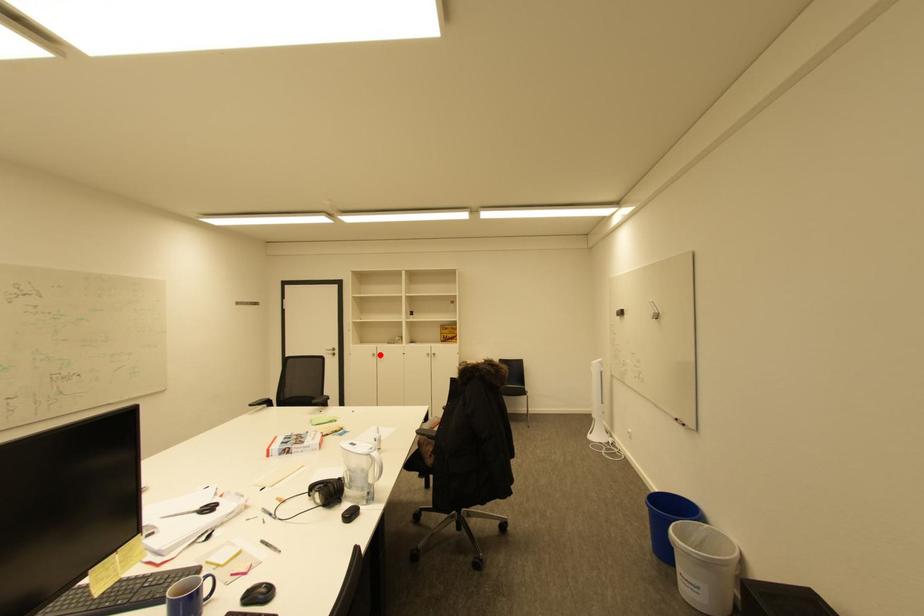
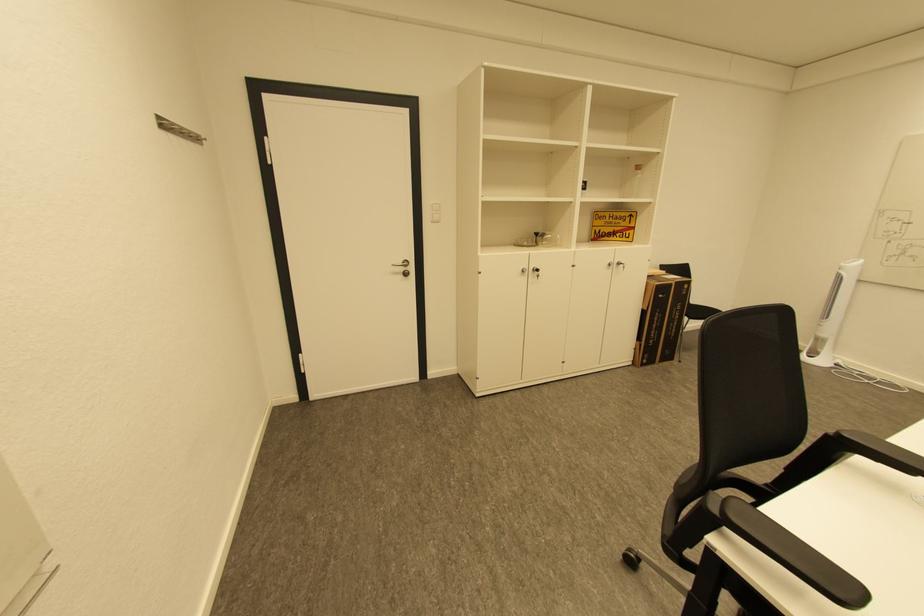
Question: I am providing you with two images of the same scene from different viewpoints. In image1, a red point is highlighted. Considering the same 3D point in image2, which of the following is correct?

Choices:
 (A) It is closer
 (B) It is farther

Answer: (A)